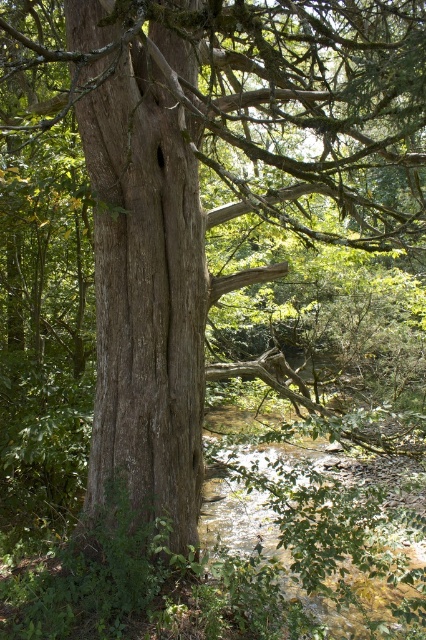
Question: Is smooth brown tree trunk at center positioned before clear water at lower center?

Choices:
 (A) no
 (B) yes

Answer: (B)

Question: Which point is farther from the camera taking this photo?

Choices:
 (A) (114, 38)
 (B) (227, 481)

Answer: (B)

Question: Which of the following is the farthest from the observer?

Choices:
 (A) (103, 97)
 (B) (359, 600)

Answer: (B)

Question: Where is smooth brown tree trunk at center located in relation to clear water at lower center in the image?

Choices:
 (A) below
 (B) above

Answer: (B)

Question: Does smooth brown tree trunk at center appear under clear water at lower center?

Choices:
 (A) yes
 (B) no

Answer: (B)